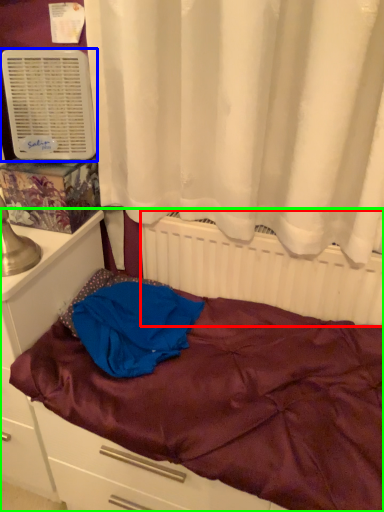
Question: Which object is the closest to the radiator (highlighted by a red box)? Choose among these: air conditioning (highlighted by a blue box) or bed (highlighted by a green box).

Choices:
 (A) air conditioning
 (B) bed

Answer: (B)